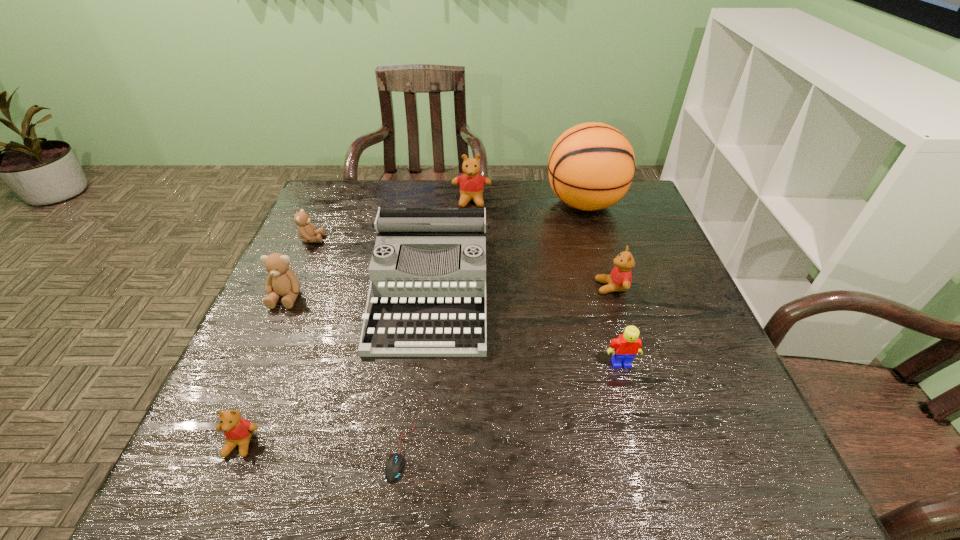
What are the coordinates of `the fourth nearest teddy bear` in the screenshot? It's located at (306, 230).

I want to click on the farther brown teddy bear, so click(306, 230).

Image resolution: width=960 pixels, height=540 pixels. I want to click on the nearest teddy bear, so click(x=238, y=431).

Image resolution: width=960 pixels, height=540 pixels. Identify the location of the smallest red teddy bear. (238, 431).

At what (x,y) coordinates should I click in order to perform the action: click on the shortest object. Please return your answer as a coordinate pair (x, y). Looking at the image, I should click on (395, 463).

Locate an element on the screen. mouse is located at coordinates (395, 463).

Locate an element on the screen. vacant position located on the right of the tallest object is located at coordinates (646, 204).

You are a GUI agent. You are given a task and a screenshot of the screen. Output one action in this format:
    pyautogui.click(x=<x>, y=<y>)
    Task: Click on the vacant space located 0.330m on the front-facing side of the second teddy bear from right to left
    
    Given the screenshot: What is the action you would take?
    pyautogui.click(x=469, y=284)

The image size is (960, 540). Find the location of `vacant region located on the typing side of the typewriter`. vacant region located on the typing side of the typewriter is located at coordinates (420, 384).

Locate an element on the screen. This screenshot has width=960, height=540. vacant space located 0.280m on the front-facing side of the second nearest red teddy bear is located at coordinates (486, 287).